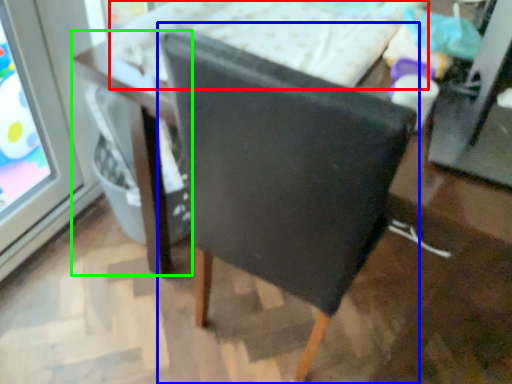
Question: Based on their relative distances, which object is farther from bed (highlighted by a red box)? Choose from chair (highlighted by a blue box) and table (highlighted by a green box).

Choices:
 (A) chair
 (B) table

Answer: (A)